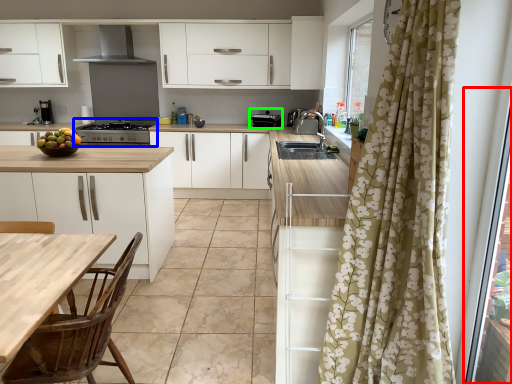
Question: Which object is the farthest from screen door (highlighted by a red box)? Choose among these: kitchen appliance (highlighted by a blue box) or appliance (highlighted by a green box).

Choices:
 (A) kitchen appliance
 (B) appliance

Answer: (A)